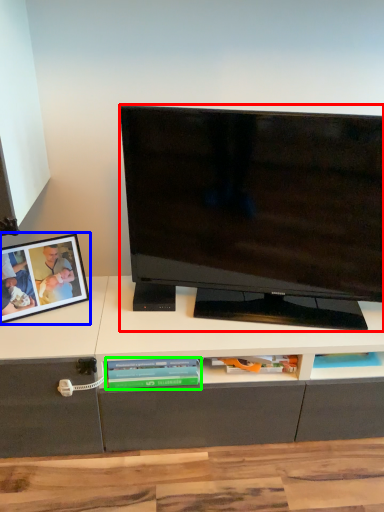
Question: Which object is positioned closest to television (highlighted by a red box)? Select from picture frame (highlighted by a blue box) and book (highlighted by a green box).

Choices:
 (A) picture frame
 (B) book

Answer: (B)